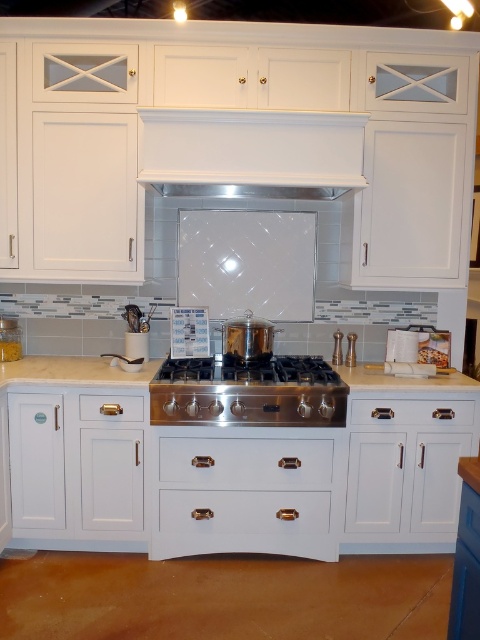
Looking at this image, does satin brass drawer at center have a lesser width compared to white marble countertop at center?

No.

Who is more forward, (214, 444) or (60, 371)?

Positioned in front is point (214, 444).

Find the location of `satin brass drawer at center`. satin brass drawer at center is located at coordinates (245, 461).

Where is `satin brass drawer at center`? This screenshot has width=480, height=640. satin brass drawer at center is located at coordinates (245, 461).

Consider the image. Between white glossy exhaust hood at center and white marble countertop at center, which one is positioned higher?

Positioned higher is white glossy exhaust hood at center.

Who is more distant from viewer, (159, 176) or (149, 369)?

Point (149, 369)

The image size is (480, 640). In order to click on white glossy exhaust hood at center in this screenshot , I will do `click(251, 152)`.

Who is positioned more to the right, stainless steel stove at center or white wood drawer at center?

white wood drawer at center is more to the right.

Is stainless steel stove at center closer to camera compared to white wood drawer at center?

Yes, it is in front of white wood drawer at center.

Who is more forward, (x=276, y=387) or (x=364, y=404)?

Point (x=276, y=387) is in front.

I want to click on stainless steel stove at center, so point(248,392).